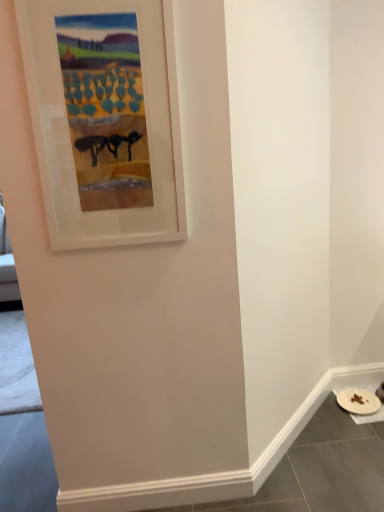
Question: Should I look upward or downward to see white matte plate at lower right?

Choices:
 (A) down
 (B) up

Answer: (A)

Question: Is white matte plate at lower right positioned with its back to wooden picture frame at upper left?

Choices:
 (A) yes
 (B) no

Answer: (B)

Question: Does white matte plate at lower right have a greater width compared to wooden picture frame at upper left?

Choices:
 (A) no
 (B) yes

Answer: (B)

Question: From a real-world perspective, is white matte plate at lower right beneath wooden picture frame at upper left?

Choices:
 (A) yes
 (B) no

Answer: (A)

Question: Considering the relative sizes of white matte plate at lower right and wooden picture frame at upper left in the image provided, is white matte plate at lower right shorter than wooden picture frame at upper left?

Choices:
 (A) no
 (B) yes

Answer: (B)

Question: Is white matte plate at lower right positioned far away from wooden picture frame at upper left?

Choices:
 (A) yes
 (B) no

Answer: (A)

Question: Does white matte plate at lower right appear on the right side of wooden picture frame at upper left?

Choices:
 (A) yes
 (B) no

Answer: (A)

Question: Does wooden picture frame at upper left have a larger size compared to white matte plate at lower right?

Choices:
 (A) no
 (B) yes

Answer: (B)

Question: From a real-world perspective, is wooden picture frame at upper left under white matte plate at lower right?

Choices:
 (A) yes
 (B) no

Answer: (B)

Question: Would you say wooden picture frame at upper left is outside white matte plate at lower right?

Choices:
 (A) no
 (B) yes

Answer: (B)

Question: Is wooden picture frame at upper left behind white matte plate at lower right?

Choices:
 (A) yes
 (B) no

Answer: (B)

Question: Is white matte plate at lower right inside wooden picture frame at upper left?

Choices:
 (A) yes
 (B) no

Answer: (B)

Question: Does wooden picture frame at upper left have a lesser height compared to white matte plate at lower right?

Choices:
 (A) no
 (B) yes

Answer: (A)

Question: In the image, is wooden picture frame at upper left positioned in front of or behind white matte plate at lower right?

Choices:
 (A) front
 (B) behind

Answer: (A)